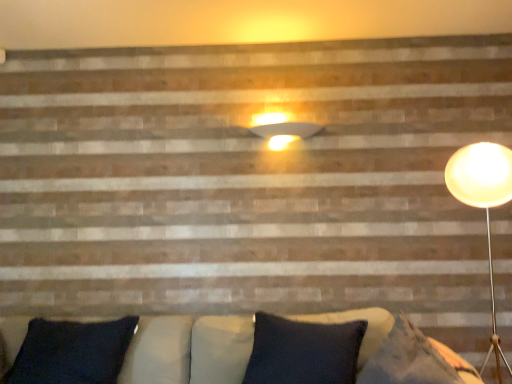
Question: Does dark blue fabric pillow at lower left lie in front of matte white wall sconce at upper center?

Choices:
 (A) no
 (B) yes

Answer: (B)

Question: Can matte white wall sconce at upper center be found inside dark blue fabric pillow at lower left?

Choices:
 (A) no
 (B) yes

Answer: (A)

Question: Does dark blue fabric pillow at lower left have a greater height compared to matte white wall sconce at upper center?

Choices:
 (A) yes
 (B) no

Answer: (A)

Question: Is dark blue fabric pillow at lower left turned away from matte white wall sconce at upper center?

Choices:
 (A) no
 (B) yes

Answer: (A)

Question: Considering the relative positions of dark blue fabric pillow at lower left and matte white wall sconce at upper center in the image provided, is dark blue fabric pillow at lower left to the left of matte white wall sconce at upper center from the viewer's perspective?

Choices:
 (A) no
 (B) yes

Answer: (B)

Question: Is dark blue fabric pillow at lower left further to the viewer compared to matte white wall sconce at upper center?

Choices:
 (A) yes
 (B) no

Answer: (B)

Question: Could you tell me if matte white wall sconce at upper center is turned towards dark blue fabric pillow at lower left?

Choices:
 (A) yes
 (B) no

Answer: (B)

Question: Is matte white wall sconce at upper center behind dark blue fabric pillow at lower left?

Choices:
 (A) yes
 (B) no

Answer: (A)

Question: Does matte white wall sconce at upper center have a greater height compared to dark blue fabric pillow at lower left?

Choices:
 (A) yes
 (B) no

Answer: (B)

Question: Is matte white wall sconce at upper center at the right side of dark blue fabric pillow at lower left?

Choices:
 (A) yes
 (B) no

Answer: (A)

Question: Can you see matte white wall sconce at upper center touching dark blue fabric pillow at lower left?

Choices:
 (A) no
 (B) yes

Answer: (A)

Question: Can you confirm if matte white wall sconce at upper center is wider than dark blue fabric pillow at lower left?

Choices:
 (A) no
 (B) yes

Answer: (A)

Question: Considering the positions of dark blue fabric pillow at lower left and matte white wall sconce at upper center in the image, is dark blue fabric pillow at lower left taller or shorter than matte white wall sconce at upper center?

Choices:
 (A) short
 (B) tall

Answer: (B)